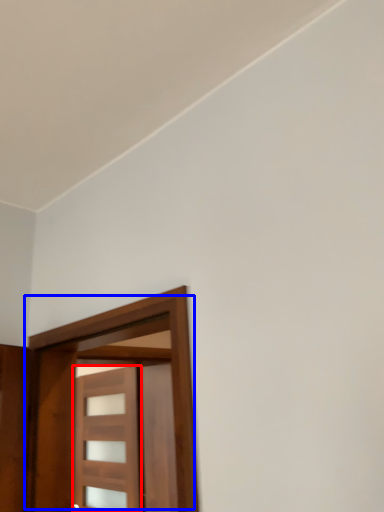
Question: Which object appears farthest to the camera in this image, door (highlighted by a red box) or door (highlighted by a blue box)?

Choices:
 (A) door
 (B) door

Answer: (A)